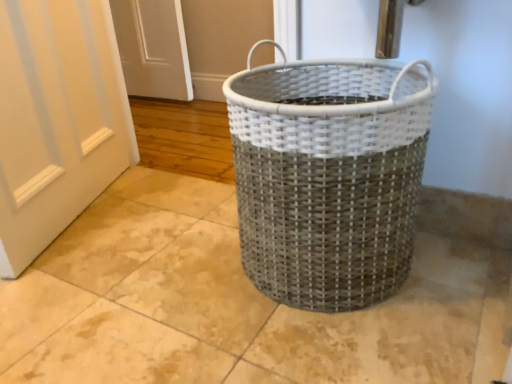
Identify the location of free space that is to the left of white woven basket at center. coord(167,281).